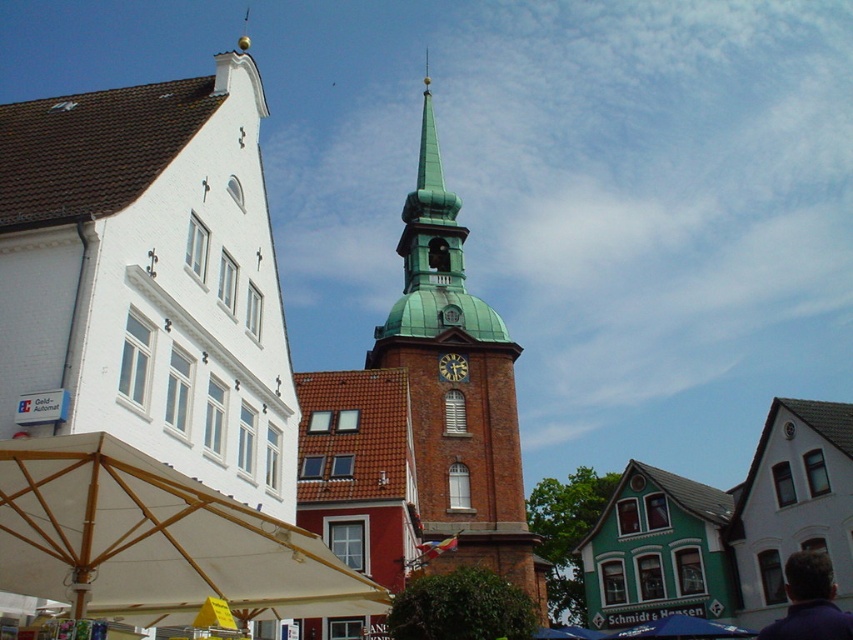
Between white matte building at upper left and purple fabric at lower right, which one has more height?

white matte building at upper left is taller.

Between point (73, 184) and point (836, 637), which one is positioned behind?

The point (73, 184) is behind.

Between point (38, 428) and point (814, 636), which one is positioned in front?

Point (814, 636) is in front.

Locate an element on the screen. The width and height of the screenshot is (853, 640). white matte building at upper left is located at coordinates (148, 280).

Does blue fabric canopy at lower center appear on the left side of dark brown wooden clock at center?

In fact, blue fabric canopy at lower center is to the right of dark brown wooden clock at center.

Between blue fabric canopy at lower center and dark brown wooden clock at center, which one has more height?

With more height is blue fabric canopy at lower center.

Who is more distant from viewer, (x=724, y=636) or (x=445, y=362)?

The point (x=445, y=362) is behind.

The image size is (853, 640). I want to click on blue fabric canopy at lower center, so click(x=682, y=628).

Looking at this image, is white fabric canopy at lower left below green copper clock tower at center?

Indeed, white fabric canopy at lower left is positioned under green copper clock tower at center.

Can you confirm if white fabric canopy at lower left is positioned to the left of green copper clock tower at center?

Indeed, white fabric canopy at lower left is positioned on the left side of green copper clock tower at center.

Is point (170, 476) behind point (463, 474)?

No, it is not.

The width and height of the screenshot is (853, 640). What are the coordinates of `white fabric canopy at lower left` in the screenshot? It's located at (154, 540).